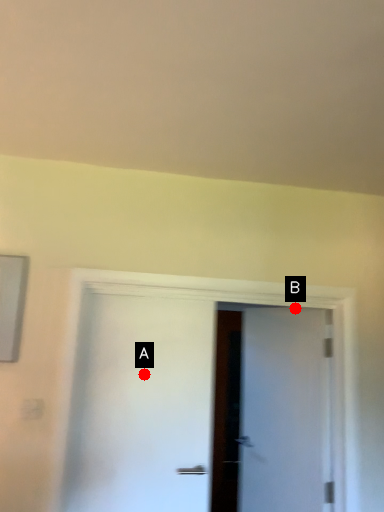
Question: Two points are circled on the image, labeled by A and B beside each circle. Which of the following is the closest to the observer?

Choices:
 (A) A is closer
 (B) B is closer

Answer: (A)